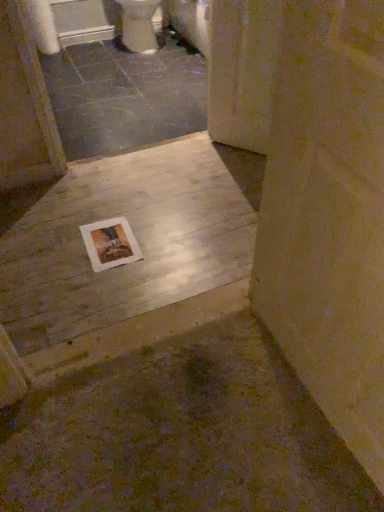
Locate an element on the screen. free space in front of wooden screen door at upper right is located at coordinates (230, 160).